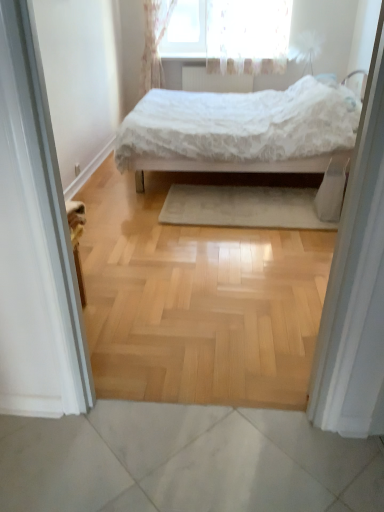
Where is `free space to the right of white fabric screen door at left, the 1th screen door from the left`? This screenshot has height=512, width=384. free space to the right of white fabric screen door at left, the 1th screen door from the left is located at coordinates (137, 322).